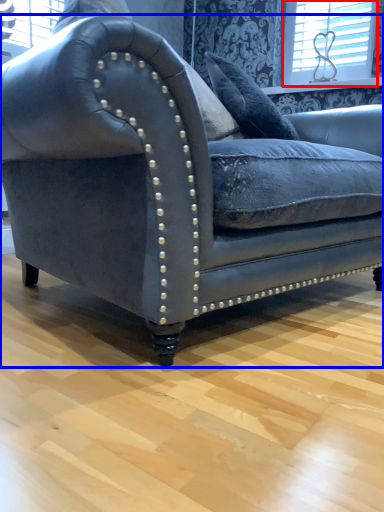
Question: Which of the following is the closest to the observer, window (highlighted by a red box) or studio couch (highlighted by a blue box)?

Choices:
 (A) window
 (B) studio couch

Answer: (B)